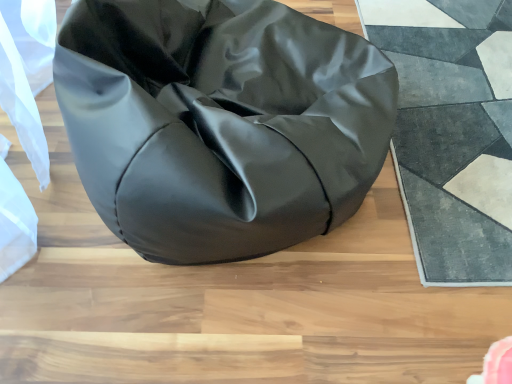
Identify the location of vacant space situated above textured gray rug at right (from a real-world perspective). The width and height of the screenshot is (512, 384). (449, 115).